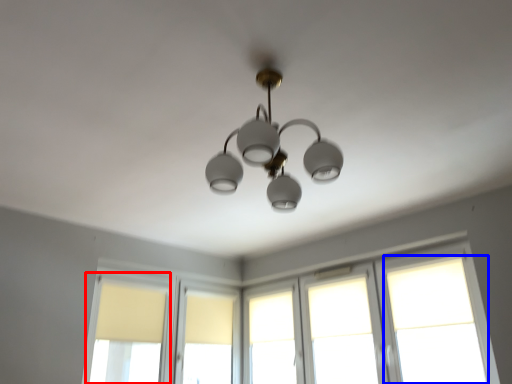
Question: Which object appears closest to the camera in this image, window (highlighted by a red box) or window (highlighted by a blue box)?

Choices:
 (A) window
 (B) window

Answer: (B)